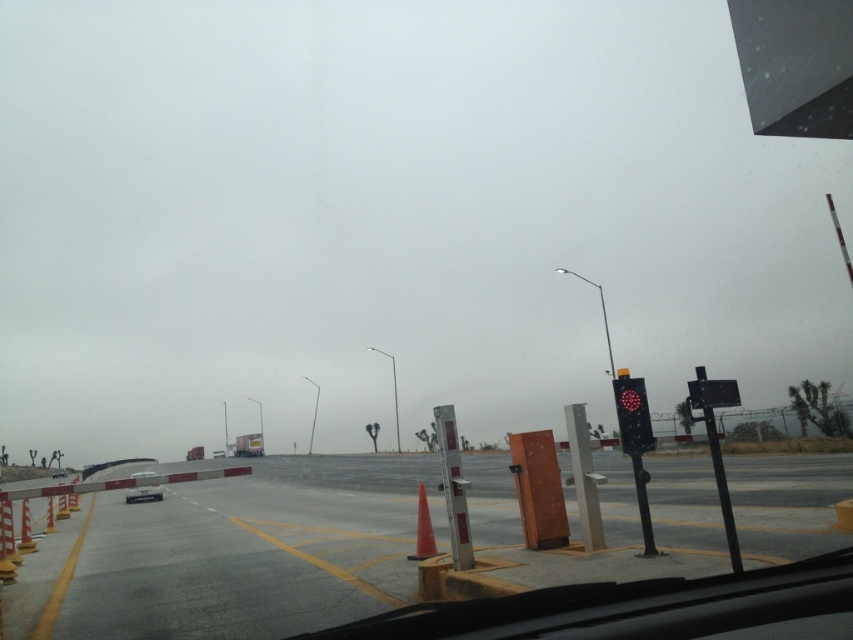
You are driving a car and see the point at coordinates (722, 490). What object is located at that point?

The point at coordinates (722, 490) indicates a black plastic traffic light at right.

You are driving a car and want to see the orange matte traffic cone at center through the transparent glass windshield at lower center. Is the cone visible through the windshield?

The transparent glass windshield at lower center is in front of the orange matte traffic cone at center, so yes, the cone is visible through the windshield.

You are driving a car that is 5 meters long. You need to pass between the orange matte traffic cone at center and the orange matte traffic cone at left. Can your car fit through the space between them without touching either cone?

The distance between the orange matte traffic cone at center and the orange matte traffic cone at left is 9.15 meters. Since your car is only 5 meters long, it can fit through the space between them without touching either cone.